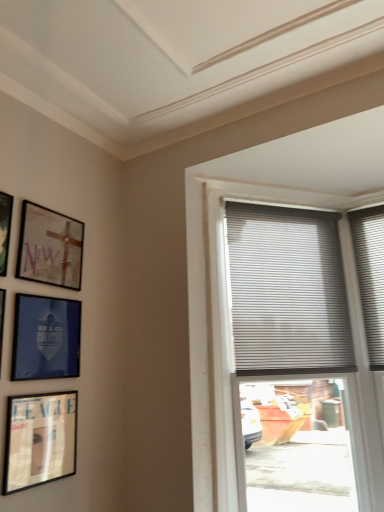
Question: Looking at their shapes, would you say matte black picture frame at lower left, the first picture frame ordered from the bottom, is wider or thinner than matte black picture frame at upper left, the 1th picture frame from the top?

Choices:
 (A) thin
 (B) wide

Answer: (B)

Question: Considering their positions, is matte black picture frame at lower left, the first picture frame ordered from the bottom, located in front of or behind matte black picture frame at upper left, which appears as the fifth picture frame when ordered from the bottom?

Choices:
 (A) front
 (B) behind

Answer: (B)

Question: Considering the real-world distances, which object is farthest from the matte black picture frame at upper left, the 1th picture frame from the top?

Choices:
 (A) matte black picture frame at left, which is the 3th picture frame from top to bottom
 (B) blue glossy picture frame at upper left, which is counted as the second picture frame, starting from the bottom
 (C) matte black picture frame at lower left, the first picture frame ordered from the bottom
 (D) gray pleated blinds at upper right
 (E) matte glass picture frame at upper left, the fourth picture frame when ordered from bottom to top

Answer: (D)

Question: Based on their relative distances, which object is nearer to the matte black picture frame at lower left, positioned as the fifth picture frame in top-to-bottom order?

Choices:
 (A) matte black picture frame at upper left, the 1th picture frame from the top
 (B) matte glass picture frame at upper left, which is the 2th picture frame in top-to-bottom order
 (C) matte black picture frame at left, which is the 3th picture frame from top to bottom
 (D) gray pleated blinds at upper right
 (E) blue glossy picture frame at upper left, which is counted as the second picture frame, starting from the bottom

Answer: (E)